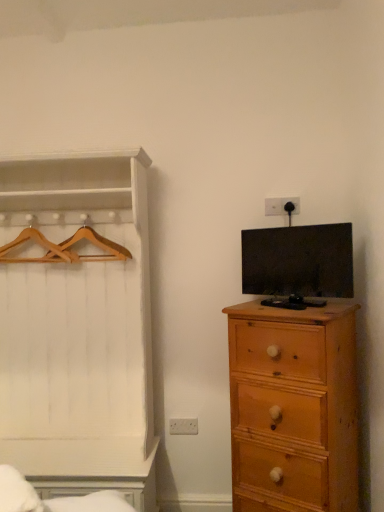
Measure the distance between point (345, 451) and camera.

Point (345, 451) and camera are 1.80 meters apart.

Where is `white wood dresser at left`? This screenshot has height=512, width=384. white wood dresser at left is located at coordinates (77, 325).

How much space does wooden hangers at left, placed as the 2th hanger when sorted from left to right, occupy horizontally?

wooden hangers at left, placed as the 2th hanger when sorted from left to right, is 5.77 inches wide.

This screenshot has width=384, height=512. What do you see at coordinates (86, 255) in the screenshot?
I see `wooden hangers at left, which appears as the 1th hanger when viewed from the right` at bounding box center [86, 255].

At what (x,y) coordinates should I click in order to perform the action: click on wooden hanger at left, which appears as the first hanger when viewed from the left. Please return your answer as a coordinate pair (x, y). Image resolution: width=384 pixels, height=512 pixels. Looking at the image, I should click on (38, 243).

Is wooden hanger at left, which is counted as the 2th hanger, starting from the right, looking in the opposite direction of matte black tv at right?

No, wooden hanger at left, which is counted as the 2th hanger, starting from the right, is not facing the opposite direction of matte black tv at right.

Can you confirm if wooden hanger at left, which appears as the first hanger when viewed from the left, is taller than matte black tv at right?

No, wooden hanger at left, which appears as the first hanger when viewed from the left, is not taller than matte black tv at right.

Starting from the matte black tv at right, which hanger is the 2nd one to the left? Please provide its 2D coordinates.

[(38, 243)]

In the image, is wooden hanger at left, which is counted as the 2th hanger, starting from the right, positioned in front of or behind matte black tv at right?

wooden hanger at left, which is counted as the 2th hanger, starting from the right, is positioned farther from the viewer than matte black tv at right.

Considering the relative positions of light brown wooden chest of drawers at right and wooden hanger at left, which is counted as the 2th hanger, starting from the right, in the image provided, is light brown wooden chest of drawers at right to the right of wooden hanger at left, which is counted as the 2th hanger, starting from the right, from the viewer's perspective?

Yes, light brown wooden chest of drawers at right is to the right of wooden hanger at left, which is counted as the 2th hanger, starting from the right.

From the image's perspective, who appears lower, light brown wooden chest of drawers at right or wooden hanger at left, which appears as the first hanger when viewed from the left?

light brown wooden chest of drawers at right is shown below in the image.

From a real-world perspective, is light brown wooden chest of drawers at right positioned above or below wooden hanger at left, which appears as the first hanger when viewed from the left?

light brown wooden chest of drawers at right is below wooden hanger at left, which appears as the first hanger when viewed from the left.

Which of these two, white wood dresser at left or wooden hangers at left, which appears as the 1th hanger when viewed from the right, is thinner?

With smaller width is wooden hangers at left, which appears as the 1th hanger when viewed from the right.

Considering the positions of point (119, 441) and point (63, 244), is point (119, 441) closer or farther from the camera than point (63, 244)?

Point (119, 441) is positioned closer to the camera compared to point (63, 244).

From a real-world perspective, which hanger is the 2nd one above the white wood dresser at left? Please provide its 2D coordinates.

[(86, 255)]

From the image's perspective, who appears lower, white wood dresser at left or wooden hangers at left, which appears as the 1th hanger when viewed from the right?

From the image's view, white wood dresser at left is below.

Consider the image. From a real-world perspective, which is physically below, white wood dresser at left or wooden hanger at left, which is counted as the 2th hanger, starting from the right?

white wood dresser at left.

From the picture: Can you tell me how much white wood dresser at left and wooden hanger at left, which is counted as the 2th hanger, starting from the right, differ in facing direction?

There is a 1.33-degree angle between the facing directions of white wood dresser at left and wooden hanger at left, which is counted as the 2th hanger, starting from the right.

Considering the relative positions of white wood dresser at left and wooden hanger at left, which appears as the first hanger when viewed from the left, in the image provided, is white wood dresser at left to the left or to the right of wooden hanger at left, which appears as the first hanger when viewed from the left,?

In the image, white wood dresser at left appears on the right side of wooden hanger at left, which appears as the first hanger when viewed from the left.

From the white wood dresser at left, count 2nd hangers backward and point to it. Please provide its 2D coordinates.

[(38, 243)]

From a real-world perspective, who is located lower, light brown wooden chest of drawers at right or wooden hangers at left, placed as the 2th hanger when sorted from left to right?

In real-world perspective, light brown wooden chest of drawers at right is lower.

From the image's perspective, between light brown wooden chest of drawers at right and wooden hangers at left, which appears as the 1th hanger when viewed from the right, which one is located above?

From the image's view, wooden hangers at left, which appears as the 1th hanger when viewed from the right, is above.

What are the coordinates of `the 1st hanger to the left when counting from the light brown wooden chest of drawers at right` in the screenshot? It's located at coord(86,255).

In the image, is light brown wooden chest of drawers at right on the left side or the right side of wooden hangers at left, which appears as the 1th hanger when viewed from the right?

Clearly, light brown wooden chest of drawers at right is on the right of wooden hangers at left, which appears as the 1th hanger when viewed from the right, in the image.

From the image's perspective, is matte black tv at right on top of wooden hanger at left, which appears as the first hanger when viewed from the left?

Answer: Incorrect, from the image's perspective, matte black tv at right is lower than wooden hanger at left, which appears as the first hanger when viewed from the left.

Which is behind, point (343, 227) or point (36, 229)?

The point (36, 229) is behind.

Does matte black tv at right have a greater height compared to wooden hanger at left, which appears as the first hanger when viewed from the left?

Indeed, matte black tv at right has a greater height compared to wooden hanger at left, which appears as the first hanger when viewed from the left.

Does wooden hangers at left, which appears as the 1th hanger when viewed from the right, have a larger size compared to wooden hanger at left, which is counted as the 2th hanger, starting from the right?

Yes.

Is wooden hangers at left, which appears as the 1th hanger when viewed from the right, positioned with its back to wooden hanger at left, which appears as the first hanger when viewed from the left?

That's not correct — wooden hangers at left, which appears as the 1th hanger when viewed from the right, is not looking away from wooden hanger at left, which appears as the first hanger when viewed from the left.

Between wooden hangers at left, which appears as the 1th hanger when viewed from the right, and wooden hanger at left, which is counted as the 2th hanger, starting from the right, which one is positioned in front?

wooden hangers at left, which appears as the 1th hanger when viewed from the right, is in front.

Can you confirm if wooden hangers at left, placed as the 2th hanger when sorted from left to right, is thinner than wooden hanger at left, which appears as the first hanger when viewed from the left?

Incorrect, the width of wooden hangers at left, placed as the 2th hanger when sorted from left to right, is not less than that of wooden hanger at left, which appears as the first hanger when viewed from the left.

Where is `television below the wooden hanger at left, which is counted as the 2th hanger, starting from the right (from a real-world perspective)`? The width and height of the screenshot is (384, 512). television below the wooden hanger at left, which is counted as the 2th hanger, starting from the right (from a real-world perspective) is located at coordinates (298, 261).

From the image's perspective, starting from the light brown wooden chest of drawers at right, which hanger is the 1st one above? Please provide its 2D coordinates.

[(38, 243)]

Estimate the real-world distances between objects in this image. Which object is closer to matte black tv at right, light brown wooden chest of drawers at right or wooden hangers at left, placed as the 2th hanger when sorted from left to right?

light brown wooden chest of drawers at right.

Based on their spatial positions, is wooden hanger at left, which appears as the first hanger when viewed from the left, or white wood dresser at left closer to wooden hangers at left, which appears as the 1th hanger when viewed from the right?

wooden hanger at left, which appears as the first hanger when viewed from the left, is positioned closer to the anchor wooden hangers at left, which appears as the 1th hanger when viewed from the right.

Which object lies further to the anchor point wooden hanger at left, which appears as the first hanger when viewed from the left, white wood dresser at left or light brown wooden chest of drawers at right?

The object further to wooden hanger at left, which appears as the first hanger when viewed from the left, is light brown wooden chest of drawers at right.

Estimate the real-world distances between objects in this image. Which object is closer to wooden hangers at left, which appears as the 1th hanger when viewed from the right, matte black tv at right or light brown wooden chest of drawers at right?

matte black tv at right is positioned closer to the anchor wooden hangers at left, which appears as the 1th hanger when viewed from the right.

Considering their positions, is wooden hangers at left, which appears as the 1th hanger when viewed from the right, positioned further to wooden hanger at left, which appears as the first hanger when viewed from the left, than white wood dresser at left?

white wood dresser at left is further to wooden hanger at left, which appears as the first hanger when viewed from the left.

When comparing their distances from light brown wooden chest of drawers at right, does wooden hanger at left, which appears as the first hanger when viewed from the left, or wooden hangers at left, placed as the 2th hanger when sorted from left to right, seem closer?

Based on the image, wooden hangers at left, placed as the 2th hanger when sorted from left to right, appears to be nearer to light brown wooden chest of drawers at right.

Which object lies further to the anchor point matte black tv at right, wooden hangers at left, placed as the 2th hanger when sorted from left to right, or light brown wooden chest of drawers at right?

wooden hangers at left, placed as the 2th hanger when sorted from left to right, is further to matte black tv at right.

Which object lies further to the anchor point light brown wooden chest of drawers at right, wooden hangers at left, placed as the 2th hanger when sorted from left to right, or white wood dresser at left?

The object further to light brown wooden chest of drawers at right is wooden hangers at left, placed as the 2th hanger when sorted from left to right.

Identify the location of hanger between wooden hangers at left, placed as the 2th hanger when sorted from left to right, and white wood dresser at left in the up-down direction. (38, 243).

In order to click on chest of drawers between wooden hanger at left, which appears as the first hanger when viewed from the left, and matte black tv at right, in the horizontal direction in this screenshot , I will do `click(294, 407)`.

At what (x,y) coordinates should I click in order to perform the action: click on hanger between wooden hanger at left, which is counted as the 2th hanger, starting from the right, and matte black tv at right, in the horizontal direction. Please return your answer as a coordinate pair (x, y). The image size is (384, 512). Looking at the image, I should click on (86, 255).

At what (x,y) coordinates should I click in order to perform the action: click on hanger located between wooden hanger at left, which is counted as the 2th hanger, starting from the right, and light brown wooden chest of drawers at right in the left-right direction. Please return your answer as a coordinate pair (x, y). Looking at the image, I should click on (86, 255).